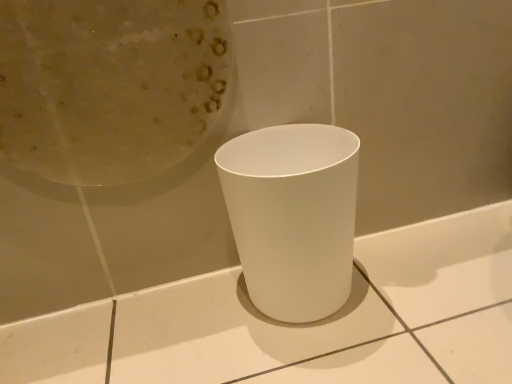
In order to click on vacant area that is situated to the right of white matte vase at center in this screenshot , I will do `click(422, 282)`.